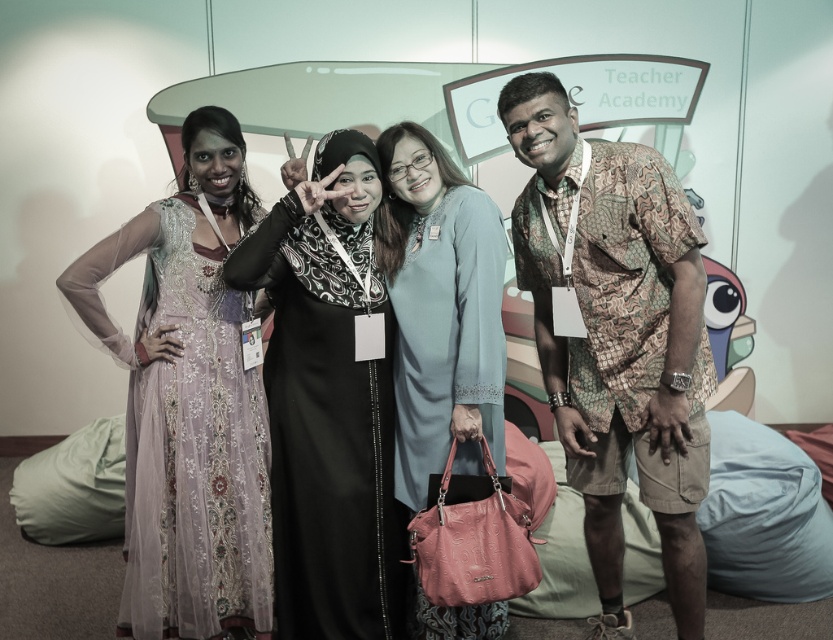
Between lavender sheer dress at left and black satin hijab at center, which one has less height?

black satin hijab at center is shorter.

Which is in front, point (263, 413) or point (392, 465)?

Point (392, 465) is in front.

Does point (198, 340) lie in front of point (385, 609)?

Yes, point (198, 340) is in front of point (385, 609).

Find the location of a particular element. lavender sheer dress at left is located at coordinates (188, 401).

Who is taller, brown patterned shirt at right or lavender sheer dress at left?

brown patterned shirt at right is taller.

Between point (669, 490) and point (196, 401), which one is positioned behind?

Positioned behind is point (196, 401).

Identify the location of brown patterned shirt at right. (617, 337).

Which is behind, point (604, 492) or point (466, 416)?

Point (604, 492)

The width and height of the screenshot is (833, 640). What do you see at coordinates (617, 337) in the screenshot?
I see `brown patterned shirt at right` at bounding box center [617, 337].

Identify the location of brown patterned shirt at right. The image size is (833, 640). (617, 337).